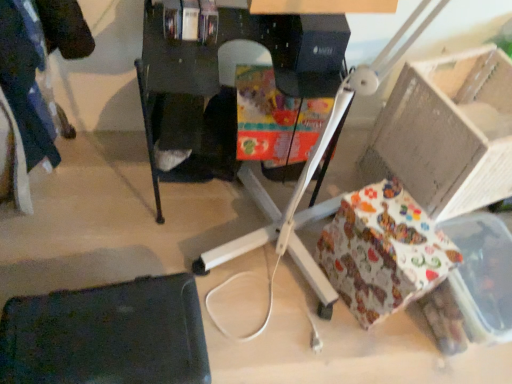
Question: Do you think black plastic desk at center is within patterned paper gift at lower right, or outside of it?

Choices:
 (A) outside
 (B) inside

Answer: (A)

Question: From a real-world perspective, is black plastic desk at center physically located above or below patterned paper gift at lower right?

Choices:
 (A) above
 (B) below

Answer: (A)

Question: Which is nearer to the white cardboard box at right?

Choices:
 (A) black matte swivel chair at lower left
 (B) black plastic desk at center
 (C) patterned paper gift at lower right

Answer: (C)

Question: Which object is positioned closest to the black matte swivel chair at lower left?

Choices:
 (A) black plastic desk at center
 (B) white cardboard box at right
 (C) patterned paper gift at lower right

Answer: (A)